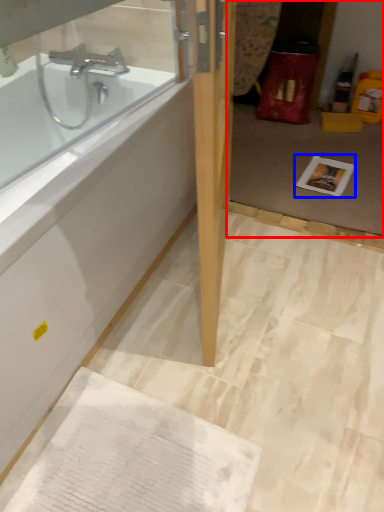
Question: Among these objects, which one is farthest to the camera, glass door (highlighted by a red box) or copy (highlighted by a blue box)?

Choices:
 (A) glass door
 (B) copy

Answer: (B)